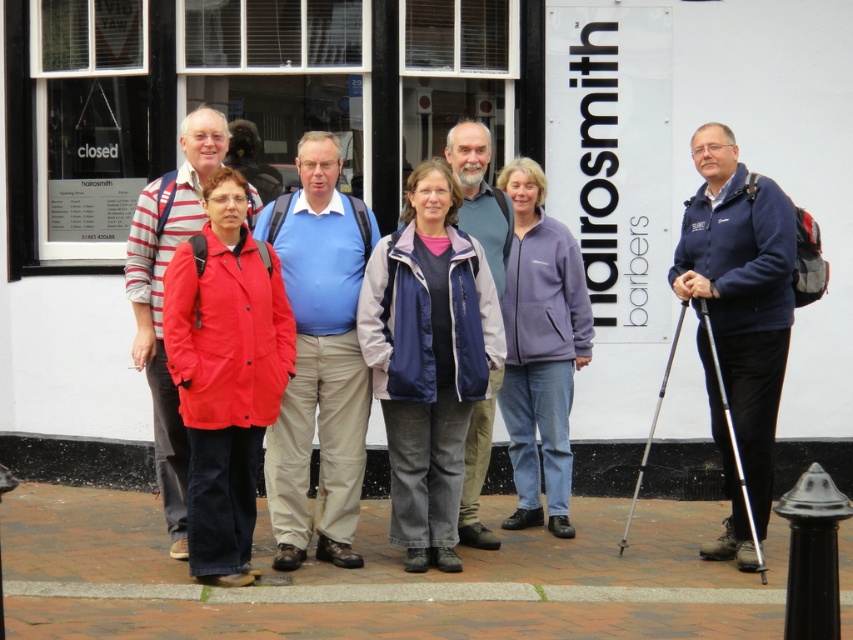
Question: Can you confirm if blue fabric shirt at center is positioned to the left of purple fleece jacket at center?

Choices:
 (A) no
 (B) yes

Answer: (B)

Question: Among these objects, which one is nearest to the camera?

Choices:
 (A) navy blue fabric jacket at center
 (B) matte red coat at center
 (C) blue fabric shirt at center
 (D) brick pavement at lower center

Answer: (D)

Question: Which object is the farthest from the brick pavement at lower center?

Choices:
 (A) navy blue fabric jacket at center
 (B) blue fabric shirt at center
 (C) purple fleece jacket at center

Answer: (C)

Question: Does brick pavement at lower center come in front of purple fleece jacket at center?

Choices:
 (A) yes
 (B) no

Answer: (A)

Question: Considering the relative positions of brick pavement at lower center and navy blue fabric jacket at center in the image provided, where is brick pavement at lower center located with respect to navy blue fabric jacket at center?

Choices:
 (A) below
 (B) above

Answer: (A)

Question: Which object is farther from the camera taking this photo?

Choices:
 (A) brick pavement at lower center
 (B) blue fabric shirt at center
 (C) matte red coat at center
 (D) purple fleece jacket at center

Answer: (D)